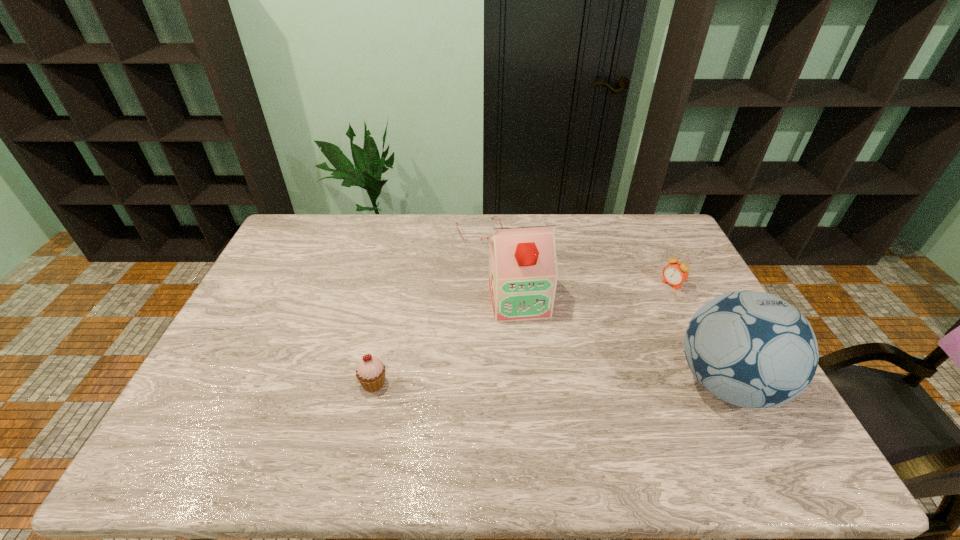
You are a GUI agent. You are given a task and a screenshot of the screen. Output one action in this format:
    pyautogui.click(x=<x>, y=<y>)
    Task: Click on the vacant region that satisfies the following two spatial constraints: 1. on the back side of the alarm clock; 2. on the right side of the soya milk
    This screenshot has height=540, width=960.
    Given the screenshot: What is the action you would take?
    pyautogui.click(x=517, y=284)